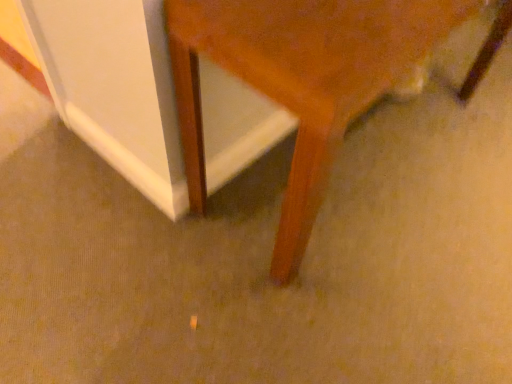
What do you see at coordinates (300, 80) in the screenshot? I see `wooden table at center` at bounding box center [300, 80].

Measure the distance between point (191, 75) and camera.

They are 1.06 meters apart.

Where is `wooden table at center`? This screenshot has width=512, height=384. wooden table at center is located at coordinates (300, 80).

What are the coordinates of `wooden table at center` in the screenshot? It's located at (300, 80).